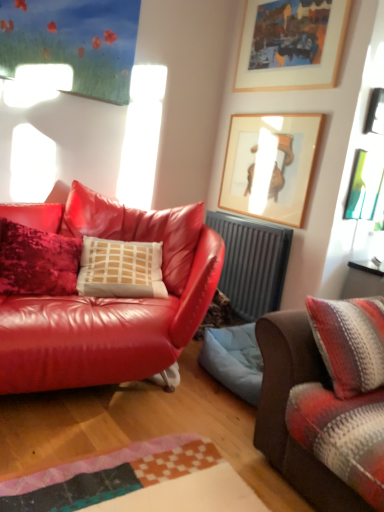
Question: Is wooden picture frame at upper center, arranged as the 4th picture frame when ordered from the bottom, wider than striped woolen blanket at right, the first studio couch positioned from the right?

Choices:
 (A) yes
 (B) no

Answer: (B)

Question: From the image's perspective, is wooden picture frame at upper center, the first picture frame from the top, above striped woolen blanket at right, arranged as the 2th studio couch when viewed from the left?

Choices:
 (A) no
 (B) yes

Answer: (B)

Question: Is wooden picture frame at upper center, arranged as the 4th picture frame when ordered from the bottom, outside of striped woolen blanket at right, the first studio couch positioned from the right?

Choices:
 (A) no
 (B) yes

Answer: (B)

Question: Does wooden picture frame at upper center, the first picture frame from the top, have a smaller size compared to striped woolen blanket at right, arranged as the 2th studio couch when viewed from the left?

Choices:
 (A) no
 (B) yes

Answer: (B)

Question: Are wooden picture frame at upper center, the first picture frame from the top, and striped woolen blanket at right, the first studio couch positioned from the right, located far from each other?

Choices:
 (A) yes
 (B) no

Answer: (A)

Question: From a real-world perspective, is wooden framed artwork at upper center, acting as the third picture frame starting from the top, above or below wooden picture frame at upper center, the first picture frame from the top?

Choices:
 (A) above
 (B) below

Answer: (B)

Question: Considering their positions, is wooden framed artwork at upper center, acting as the third picture frame starting from the top, located in front of or behind wooden picture frame at upper center, the first picture frame from the top?

Choices:
 (A) front
 (B) behind

Answer: (B)

Question: Based on their positions, is wooden framed artwork at upper center, acting as the third picture frame starting from the top, located to the left or right of wooden picture frame at upper center, arranged as the 4th picture frame when ordered from the bottom?

Choices:
 (A) left
 (B) right

Answer: (A)

Question: Looking at their shapes, would you say wooden framed artwork at upper center, the second picture frame when ordered from bottom to top, is wider or thinner than wooden picture frame at upper center, arranged as the 4th picture frame when ordered from the bottom?

Choices:
 (A) wide
 (B) thin

Answer: (B)

Question: In terms of width, does wooden picture frame at upper center, the first picture frame from the top, look wider or thinner when compared to metallic silver picture frame at upper right, acting as the second picture frame starting from the top?

Choices:
 (A) thin
 (B) wide

Answer: (A)

Question: From the image's perspective, is wooden picture frame at upper center, the first picture frame from the top, located above or below metallic silver picture frame at upper right, acting as the second picture frame starting from the top?

Choices:
 (A) below
 (B) above

Answer: (B)

Question: In the image, is wooden picture frame at upper center, arranged as the 4th picture frame when ordered from the bottom, on the left side or the right side of metallic silver picture frame at upper right, the 3th picture frame when ordered from bottom to top?

Choices:
 (A) left
 (B) right

Answer: (A)

Question: Does point (322, 53) appear closer or farther from the camera than point (375, 97)?

Choices:
 (A) closer
 (B) farther

Answer: (B)

Question: In terms of height, does gray metallic radiator at center look taller or shorter compared to shiny leather couch at left, arranged as the 2th studio couch when viewed from the right?

Choices:
 (A) tall
 (B) short

Answer: (B)

Question: From a real-world perspective, is gray metallic radiator at center physically located above or below shiny leather couch at left, arranged as the 2th studio couch when viewed from the right?

Choices:
 (A) above
 (B) below

Answer: (B)